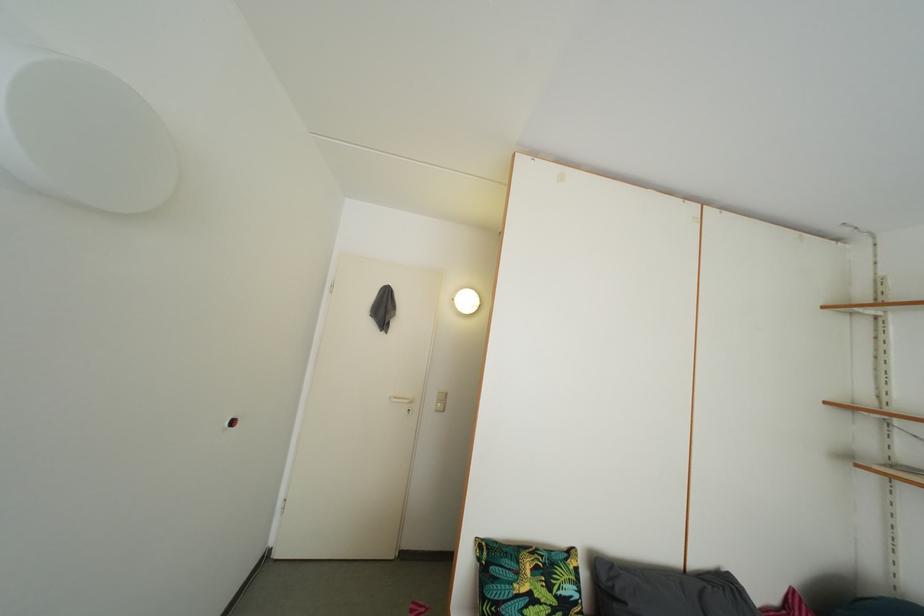
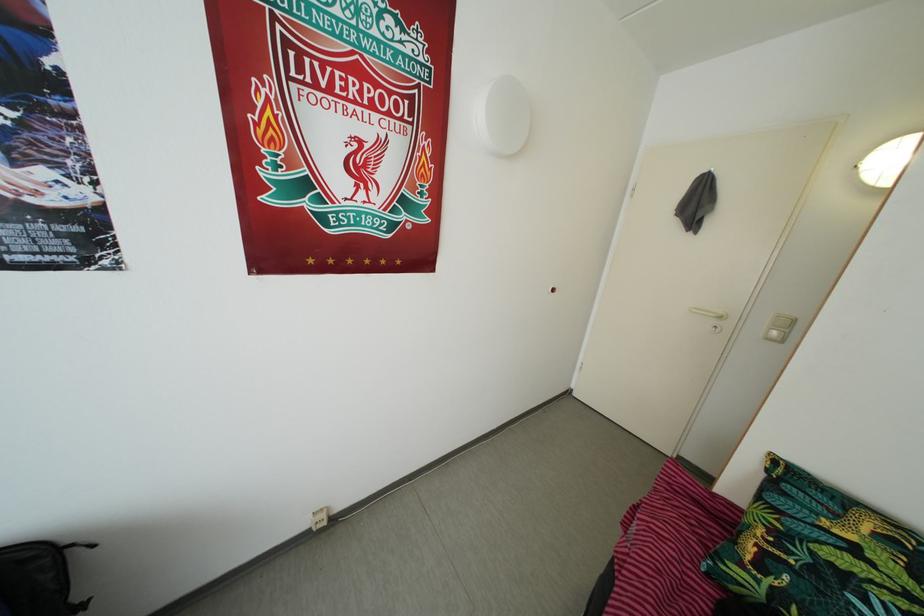
The point at (x=391, y=317) is marked in the first image. Where is the corresponding point in the second image?

(703, 213)